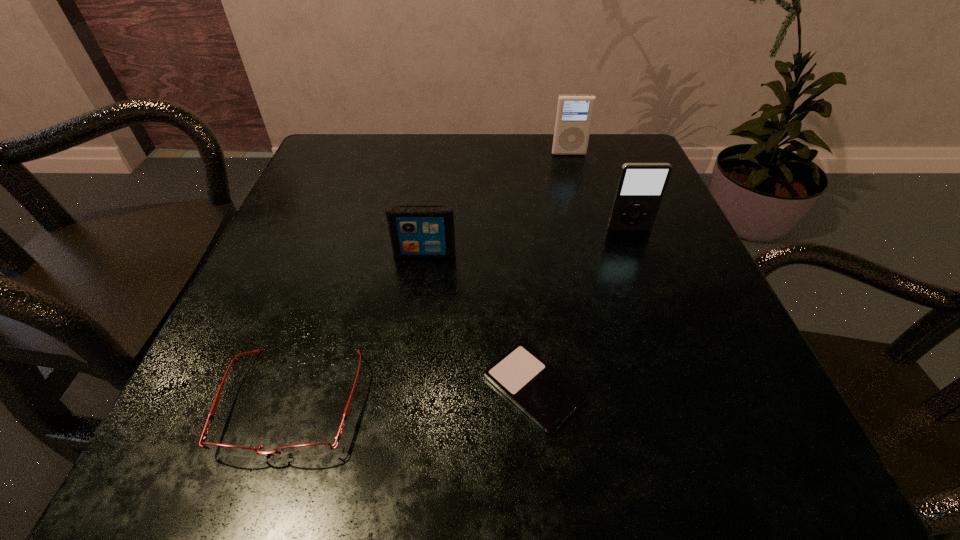
Where is `vacant point at the right edge`? vacant point at the right edge is located at coordinates (673, 234).

Locate an element on the screen. This screenshot has width=960, height=540. vacant space at the far left corner of the desktop is located at coordinates (363, 160).

I want to click on free space at the far right corner of the desktop, so click(592, 156).

In the image, there is a desktop. Find the location of `free space at the near right corner`. free space at the near right corner is located at coordinates (745, 461).

The width and height of the screenshot is (960, 540). I want to click on free space that is in between the shortest object and the third nearest iPod, so click(581, 308).

The width and height of the screenshot is (960, 540). I want to click on free space between the third object from left to right and the leftmost object, so click(x=413, y=395).

Identify the location of free spot between the farthest object and the shortest iPod. (551, 271).

At what (x,y) coordinates should I click in order to perform the action: click on free spot between the third object from left to right and the farthest iPod. Please return your answer as a coordinate pair (x, y). Looking at the image, I should click on (551, 271).

Find the location of a particular element. The image size is (960, 540). free area in between the second shortest object and the farthest object is located at coordinates (431, 278).

You are a GUI agent. You are given a task and a screenshot of the screen. Output one action in this format:
    pyautogui.click(x=<x>, y=<y>)
    Task: Click on the empty space between the third tallest iPod and the farthest object
    The image size is (960, 540).
    Given the screenshot: What is the action you would take?
    pyautogui.click(x=496, y=204)